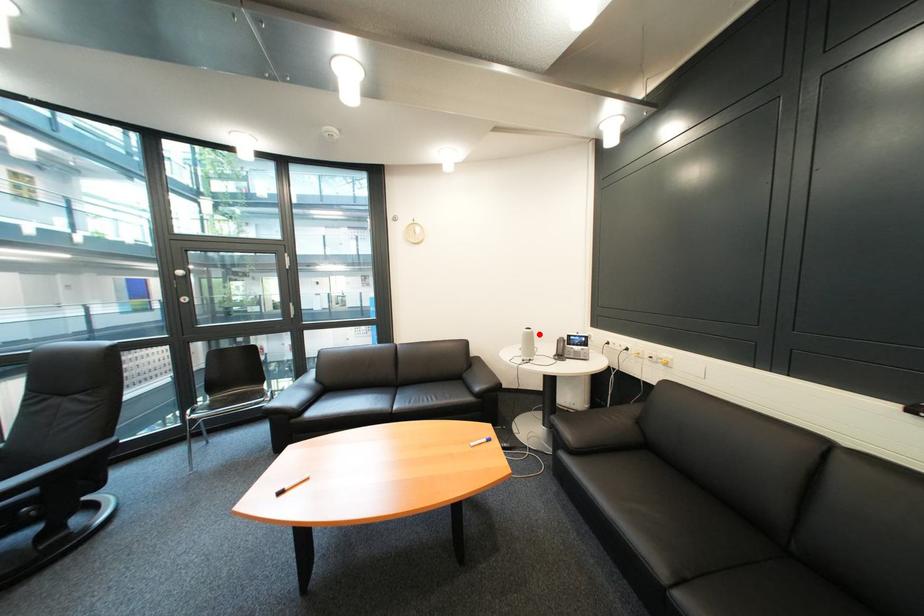
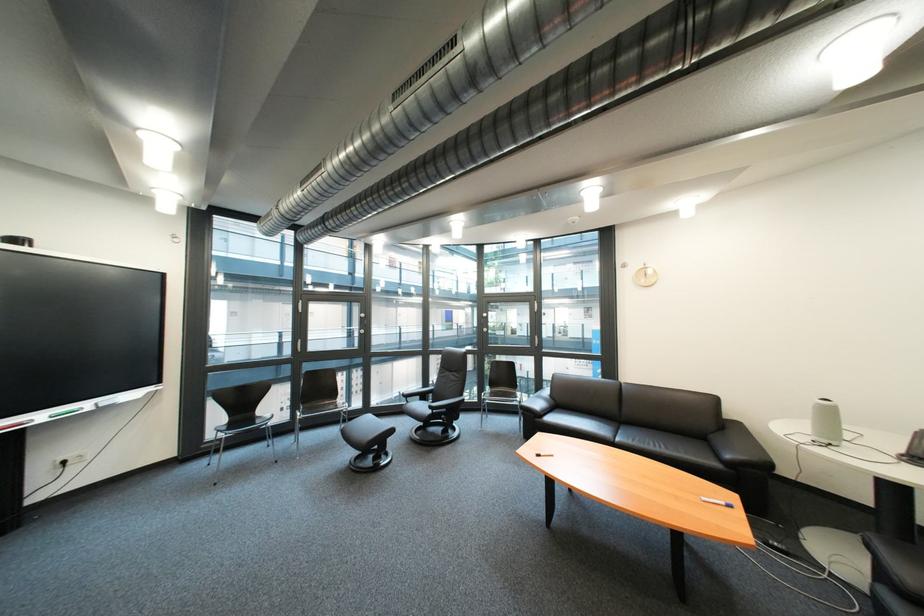
Question: I am providing you with two images of the same scene from different viewpoints. Image1 has a red point marked. In image2, the corresponding 3D location appears at what relative position? Reply with the corresponding letter.

Choices:
 (A) Closer
 (B) Farther

Answer: (A)